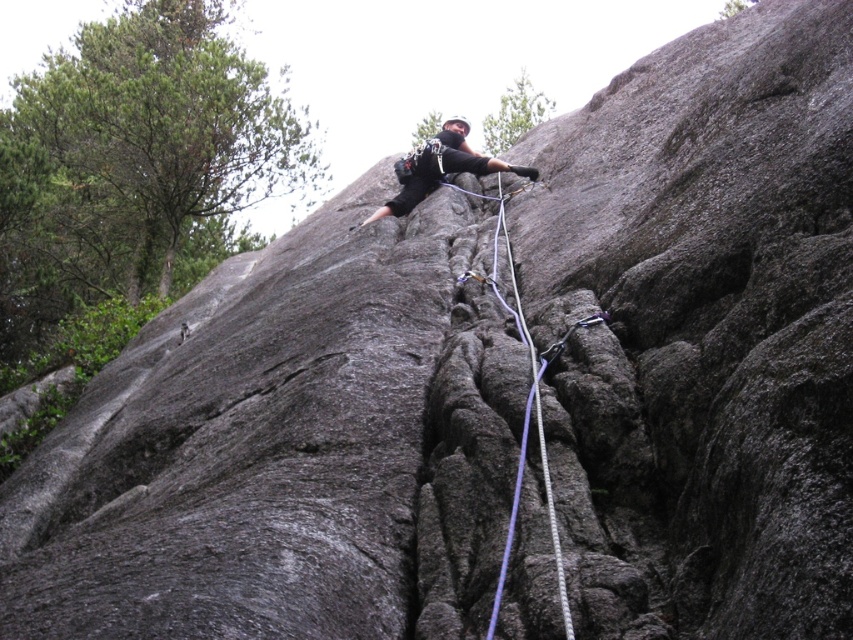
In the scene shown: Who is more forward, (431, 188) or (498, 200)?

Positioned in front is point (498, 200).

Which is behind, point (428, 186) or point (509, 275)?

The point (428, 186) is behind.

Locate an element on the screen. The width and height of the screenshot is (853, 640). black matte climbing harness at center is located at coordinates (440, 168).